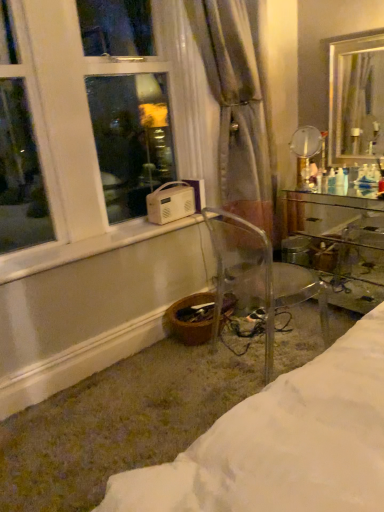
Question: Is transparent plastic chair at lower center smaller than metallic gold mirror at upper right, the second mirror in the left-to-right sequence?

Choices:
 (A) no
 (B) yes

Answer: (A)

Question: Can you confirm if transparent plastic chair at lower center is wider than metallic gold mirror at upper right, the second mirror in the left-to-right sequence?

Choices:
 (A) no
 (B) yes

Answer: (B)

Question: Is transparent plastic chair at lower center aimed at metallic gold mirror at upper right, arranged as the 1th mirror when viewed from the right?

Choices:
 (A) no
 (B) yes

Answer: (B)

Question: Is metallic gold mirror at upper right, arranged as the 1th mirror when viewed from the right, at the back of transparent plastic chair at lower center?

Choices:
 (A) yes
 (B) no

Answer: (B)

Question: Is transparent plastic chair at lower center thinner than metallic gold mirror at upper right, arranged as the 1th mirror when viewed from the right?

Choices:
 (A) no
 (B) yes

Answer: (A)

Question: From their relative heights in the image, would you say clear glass mirror at upper right, acting as the 1th mirror starting from the left, is taller or shorter than clear glass desk at right?

Choices:
 (A) short
 (B) tall

Answer: (A)

Question: In terms of size, does clear glass mirror at upper right, marked as the 2th mirror in a right-to-left arrangement, appear bigger or smaller than clear glass desk at right?

Choices:
 (A) small
 (B) big

Answer: (A)

Question: Do you think clear glass mirror at upper right, marked as the 2th mirror in a right-to-left arrangement, is within clear glass desk at right, or outside of it?

Choices:
 (A) inside
 (B) outside

Answer: (B)

Question: In terms of width, does clear glass mirror at upper right, marked as the 2th mirror in a right-to-left arrangement, look wider or thinner when compared to clear glass desk at right?

Choices:
 (A) wide
 (B) thin

Answer: (B)

Question: Looking at their shapes, would you say metallic gold mirror at upper right, the second mirror in the left-to-right sequence, is wider or thinner than white plastic window at lower left?

Choices:
 (A) thin
 (B) wide

Answer: (A)

Question: Is metallic gold mirror at upper right, the second mirror in the left-to-right sequence, taller or shorter than white plastic window at lower left?

Choices:
 (A) short
 (B) tall

Answer: (A)

Question: Is metallic gold mirror at upper right, the second mirror in the left-to-right sequence, in front of or behind white plastic window at lower left in the image?

Choices:
 (A) front
 (B) behind

Answer: (B)

Question: Is metallic gold mirror at upper right, the second mirror in the left-to-right sequence, bigger or smaller than white plastic window at lower left?

Choices:
 (A) big
 (B) small

Answer: (B)

Question: Considering the positions of transparent plastic chair at lower center and translucent fabric curtain at center in the image, is transparent plastic chair at lower center bigger or smaller than translucent fabric curtain at center?

Choices:
 (A) big
 (B) small

Answer: (B)

Question: Is transparent plastic chair at lower center wider or thinner than translucent fabric curtain at center?

Choices:
 (A) thin
 (B) wide

Answer: (B)